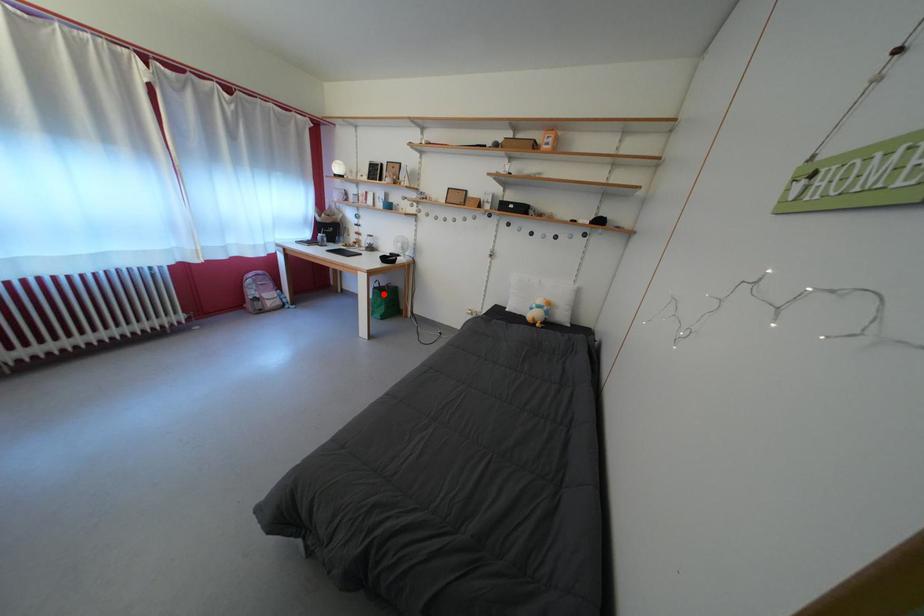
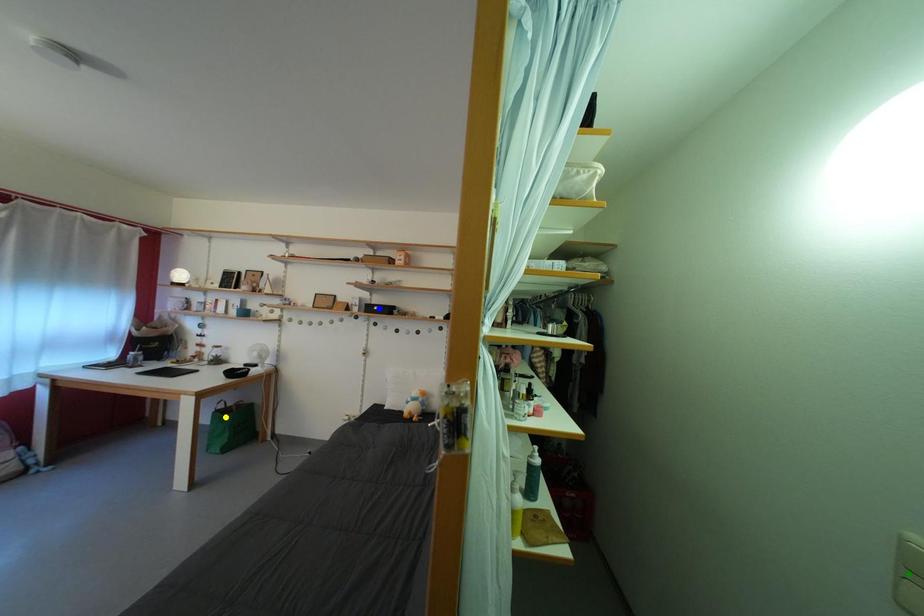
Question: I am providing you with two images of the same scene from different viewpoints. A red point is marked on the first image. You are given multiple points on the second image. Can you choose the point in image 2 that corresponds to the point in image 1?

Choices:
 (A) yellow point
 (B) green point
 (C) blue point

Answer: (A)